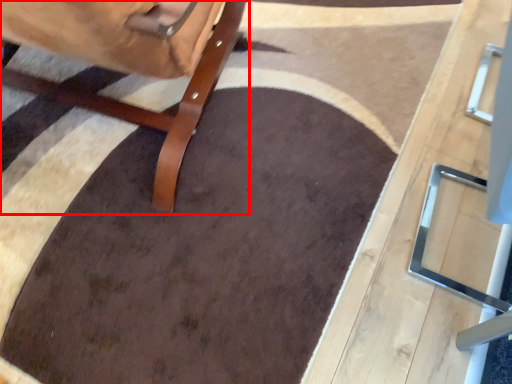
Question: From the image, what is the correct spatial relationship of furniture (annotated by the red box) in relation to table?

Choices:
 (A) right
 (B) left

Answer: (B)